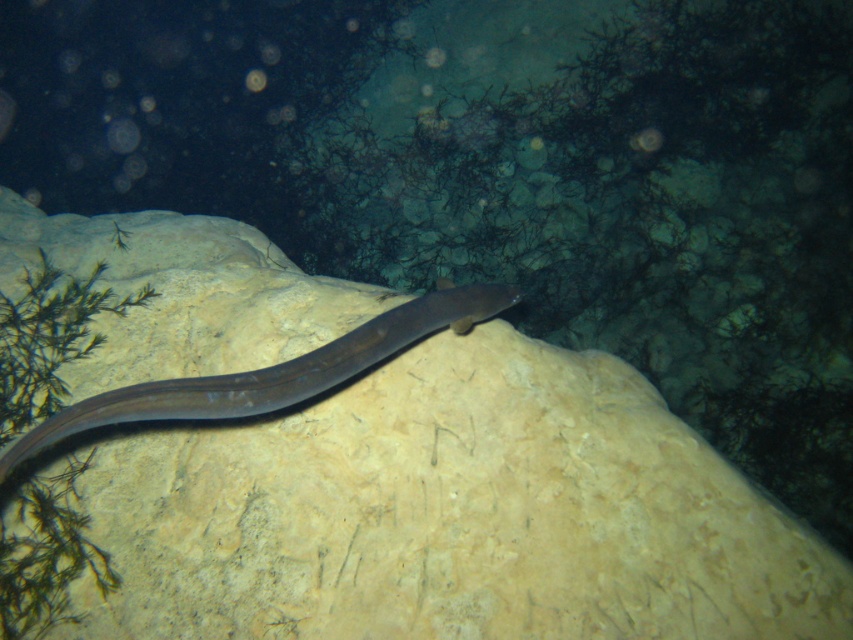
Find the location of `smooth beige rock at center`. smooth beige rock at center is located at coordinates (450, 513).

Does smooth beige rock at center have a lesser width compared to smooth gray snake at center?

Incorrect, smooth beige rock at center's width is not less than smooth gray snake at center's.

Where is `smooth beige rock at center`? This screenshot has width=853, height=640. smooth beige rock at center is located at coordinates (450, 513).

The height and width of the screenshot is (640, 853). In order to click on smooth beige rock at center in this screenshot , I will do `click(450, 513)`.